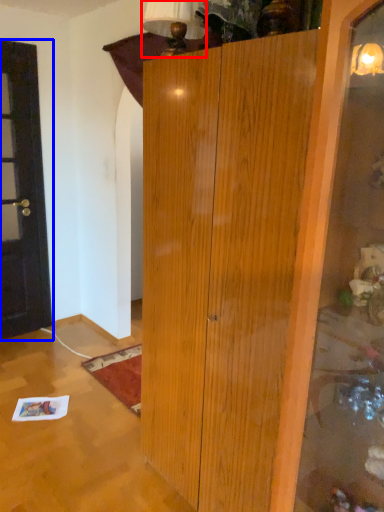
Question: Which object is further to the camera taking this photo, lamp (highlighted by a red box) or door (highlighted by a blue box)?

Choices:
 (A) lamp
 (B) door

Answer: (B)